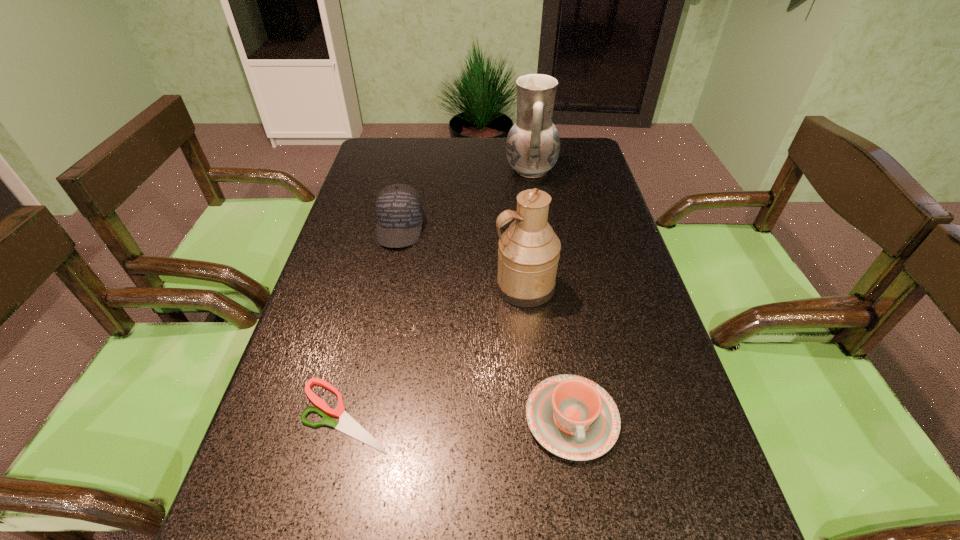
The height and width of the screenshot is (540, 960). I want to click on free space at the left edge of the desktop, so click(350, 382).

In the image, there is a desktop. In order to click on vacant space at the right edge in this screenshot , I will do `click(577, 185)`.

Identify the location of free location at the far left corner. Image resolution: width=960 pixels, height=540 pixels. (395, 161).

The image size is (960, 540). I want to click on vacant area at the far right corner, so click(577, 156).

Image resolution: width=960 pixels, height=540 pixels. In order to click on free space that is in between the farthest object and the shortest object in this screenshot , I will do `click(438, 293)`.

Identify the location of empty space that is in between the third tallest object and the third nearest object. Image resolution: width=960 pixels, height=540 pixels. (462, 257).

Image resolution: width=960 pixels, height=540 pixels. I want to click on free space between the baseball cap and the farther pitcher, so click(466, 199).

At what (x,y) coordinates should I click in order to perform the action: click on vacant space that is in between the fourth tallest object and the third shortest object. Please return your answer as a coordinate pair (x, y). Looking at the image, I should click on (486, 323).

Locate an element on the screen. This screenshot has height=540, width=960. blank region between the second shortest object and the scissors is located at coordinates (459, 417).

Where is `unoccupied area between the third farthest object and the baseball cap`? The image size is (960, 540). unoccupied area between the third farthest object and the baseball cap is located at coordinates (462, 257).